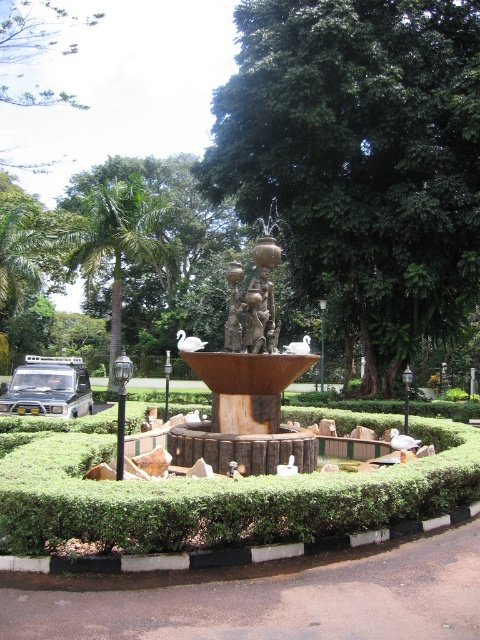
Question: Which of these objects is positioned closest to the bronze statue at center?

Choices:
 (A) green leafy hedge at center
 (B) green leafy tree at upper left

Answer: (A)

Question: Does green leafy tree at left appear over bronze statue at center?

Choices:
 (A) no
 (B) yes

Answer: (B)

Question: Where is green leafy tree at left located in relation to bronze statue at center in the image?

Choices:
 (A) above
 (B) below

Answer: (A)

Question: Estimate the real-world distances between objects in this image. Which object is closer to the bronze statue at center?

Choices:
 (A) green leafy tree at left
 (B) green leafy tree at center
 (C) green leafy hedge at center
 (D) green leafy tree at upper left

Answer: (B)

Question: Considering the relative positions of green leafy tree at center and bronze statue at center in the image provided, where is green leafy tree at center located with respect to bronze statue at center?

Choices:
 (A) left
 (B) right

Answer: (B)

Question: Considering the real-world distances, which object is closest to the green leafy hedge at center?

Choices:
 (A) green leafy tree at center
 (B) bronze statue at center
 (C) rusty metal fountain at center
 (D) green leafy tree at left

Answer: (C)